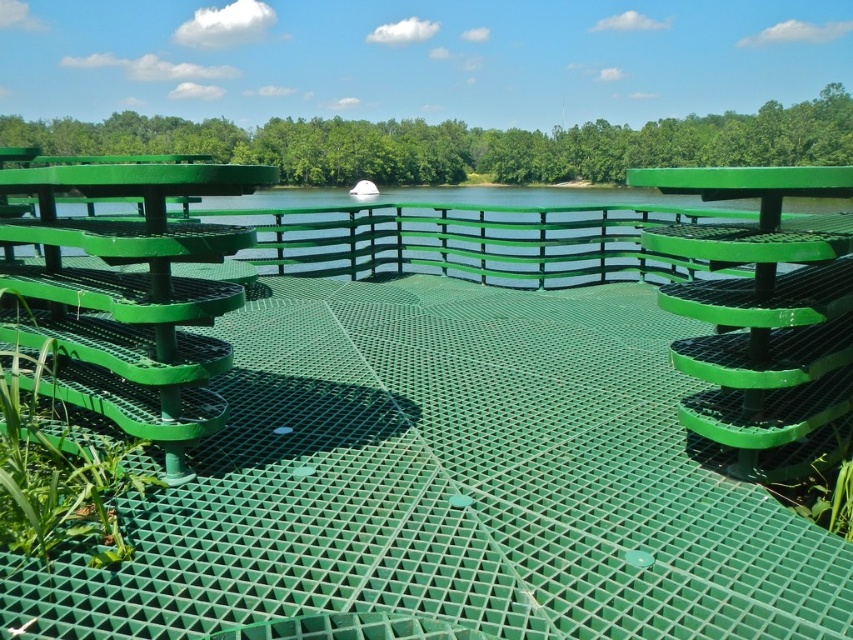
You are standing on the viewing platform and want to walk from the point at coordinates point (222, 166) to the point at coordinates point (643, 275). Which direction should you face to move towards the latter point?

You should face towards the direction of point (643, 275), which is behind point (222, 166). Since point (222, 166) is in front of point (643, 275), you need to walk backward to reach the latter point.

You are a visitor standing on the viewing platform. You see the green matte bench at center and the green mesh water at center. Which object is taller?

The green mesh water at center is taller than the green matte bench at center.

You are a visitor standing on the platform and want to sit down. You see the green plastic bench at upper left and the green mesh water at center. Which object is closer to you?

The green plastic bench at upper left is closer because it is in front of the green mesh water at center.